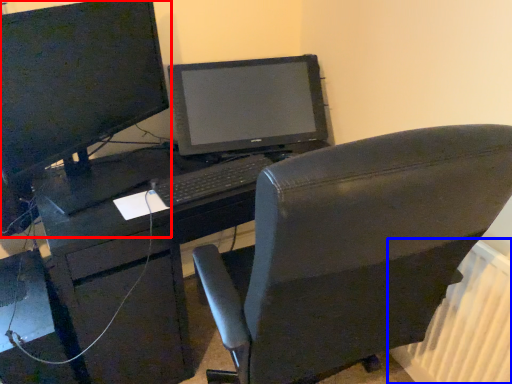
Question: Which point is further to the camera, computer monitor (highlighted by a red box) or radiator (highlighted by a blue box)?

Choices:
 (A) computer monitor
 (B) radiator

Answer: (B)